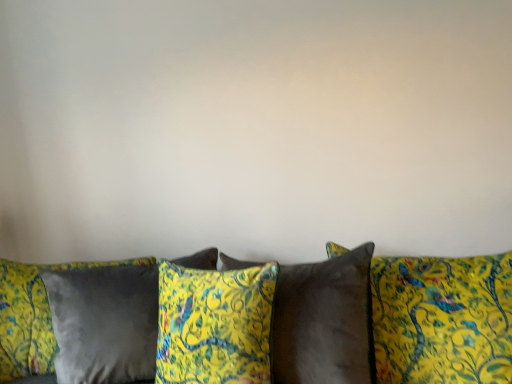
Question: Would you say velvet yellow pillow at center, positioned as the second pillow in right-to-left order, is part of satin brown pillow at center, which appears as the 1th pillow when viewed from the right,'s contents?

Choices:
 (A) yes
 (B) no

Answer: (B)

Question: From a real-world perspective, is satin brown pillow at center, which appears as the 1th pillow when viewed from the right, located higher than velvet yellow pillow at center, positioned as the second pillow in right-to-left order?

Choices:
 (A) yes
 (B) no

Answer: (B)

Question: Does satin brown pillow at center, the 4th pillow positioned from the left, have a greater width compared to velvet yellow pillow at center, which ranks as the 3th pillow in left-to-right order?

Choices:
 (A) no
 (B) yes

Answer: (B)

Question: Does satin brown pillow at center, which appears as the 1th pillow when viewed from the right, have a lesser width compared to velvet yellow pillow at center, which ranks as the 3th pillow in left-to-right order?

Choices:
 (A) yes
 (B) no

Answer: (B)

Question: Is satin brown pillow at center, which appears as the 1th pillow when viewed from the right, not within velvet yellow pillow at center, positioned as the second pillow in right-to-left order?

Choices:
 (A) no
 (B) yes

Answer: (B)

Question: Considering the positions of velvet yellow pillow at center, which ranks as the 3th pillow in left-to-right order, and velvet yellow pillows at center in the image, is velvet yellow pillow at center, which ranks as the 3th pillow in left-to-right order, wider or thinner than velvet yellow pillows at center?

Choices:
 (A) thin
 (B) wide

Answer: (A)

Question: Choose the correct answer: Is velvet yellow pillow at center, positioned as the second pillow in right-to-left order, inside velvet yellow pillows at center or outside it?

Choices:
 (A) outside
 (B) inside

Answer: (B)

Question: From the image's perspective, is velvet yellow pillow at center, positioned as the second pillow in right-to-left order, above or below velvet yellow pillows at center?

Choices:
 (A) below
 (B) above

Answer: (B)

Question: From a real-world perspective, relative to velvet yellow pillows at center, is velvet yellow pillow at center, which ranks as the 3th pillow in left-to-right order, vertically above or below?

Choices:
 (A) above
 (B) below

Answer: (A)

Question: Does point (495, 284) appear closer or farther from the camera than point (117, 269)?

Choices:
 (A) farther
 (B) closer

Answer: (B)

Question: In terms of height, does satin brown pillow at center, the 4th pillow positioned from the left, look taller or shorter compared to satin gray pillow at lower left, the 4th pillow positioned from the right?

Choices:
 (A) tall
 (B) short

Answer: (B)

Question: Considering their positions, is satin brown pillow at center, which appears as the 1th pillow when viewed from the right, located in front of or behind satin gray pillow at lower left, the first pillow viewed from the left?

Choices:
 (A) behind
 (B) front

Answer: (B)

Question: Is satin brown pillow at center, the 4th pillow positioned from the left, situated inside satin gray pillow at lower left, the first pillow viewed from the left, or outside?

Choices:
 (A) inside
 (B) outside

Answer: (B)

Question: From a real-world perspective, relative to velvet yellow pillow at center, positioned as the second pillow in right-to-left order, is velvet yellow pillows at center vertically above or below?

Choices:
 (A) above
 (B) below

Answer: (B)

Question: Considering the positions of point (415, 326) and point (283, 337), is point (415, 326) closer or farther from the camera than point (283, 337)?

Choices:
 (A) farther
 (B) closer

Answer: (B)